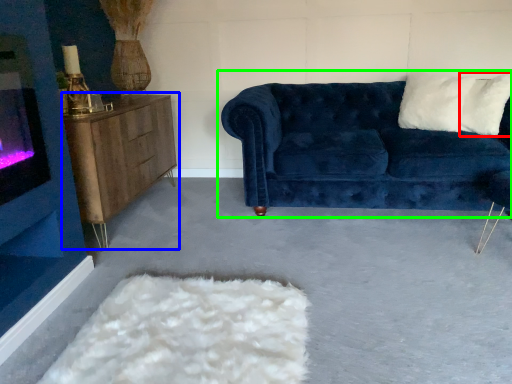
Question: Considering the real-world distances, which object is farthest from pillow (highlighted by a red box)? table (highlighted by a blue box) or studio couch (highlighted by a green box)?

Choices:
 (A) table
 (B) studio couch

Answer: (A)